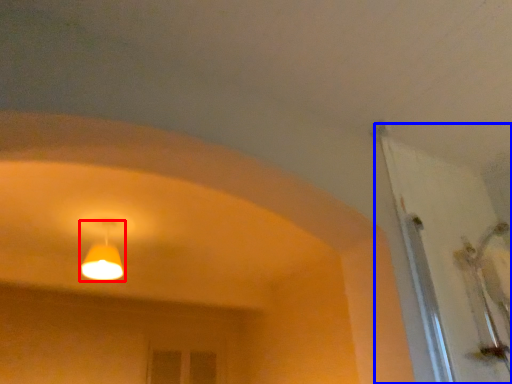
Question: Which of the following is the closest to the observer, lamp (highlighted by a red box) or door (highlighted by a blue box)?

Choices:
 (A) lamp
 (B) door

Answer: (B)